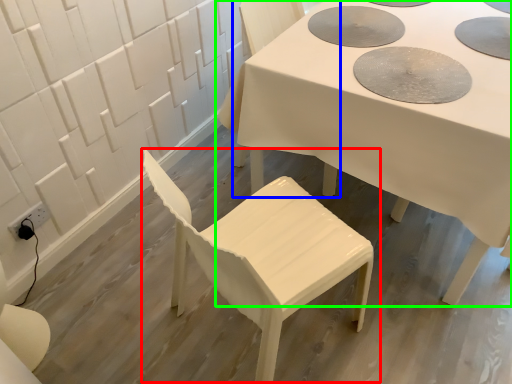
Question: Based on their relative distances, which object is nearer to chair (highlighted by a red box)? Choose from chair (highlighted by a blue box) and table (highlighted by a green box).

Choices:
 (A) chair
 (B) table

Answer: (B)